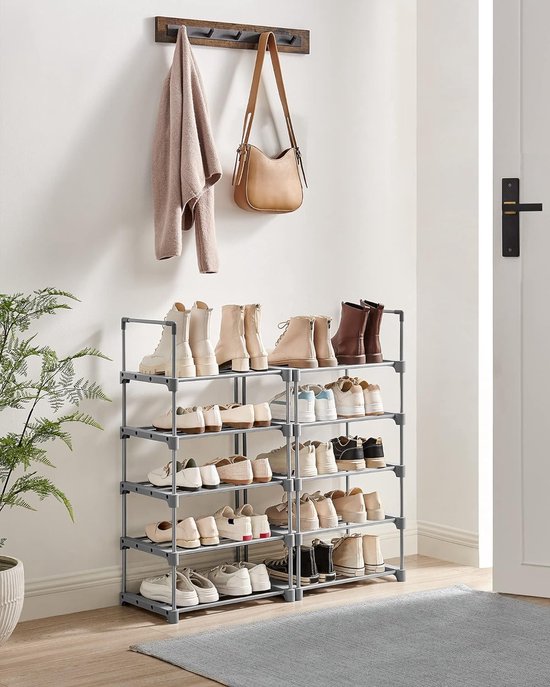
At what (x,y) coordinates should I click in order to perform the action: click on hooks. Please return your answer as a coordinate pair (x, y). Image resolution: width=550 pixels, height=687 pixels. Looking at the image, I should click on (181, 31), (208, 36), (238, 36), (263, 38), (302, 38).